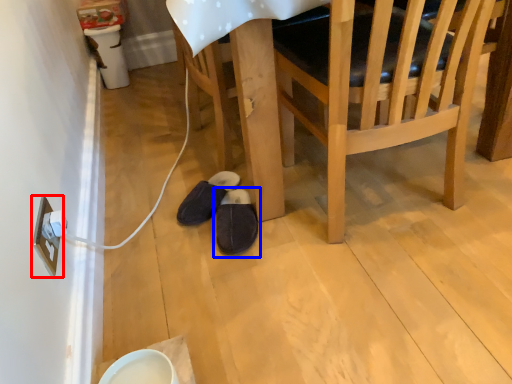
Question: Which point is closer to the camera, electric outlet (highlighted by a red box) or footwear (highlighted by a blue box)?

Choices:
 (A) electric outlet
 (B) footwear

Answer: (A)